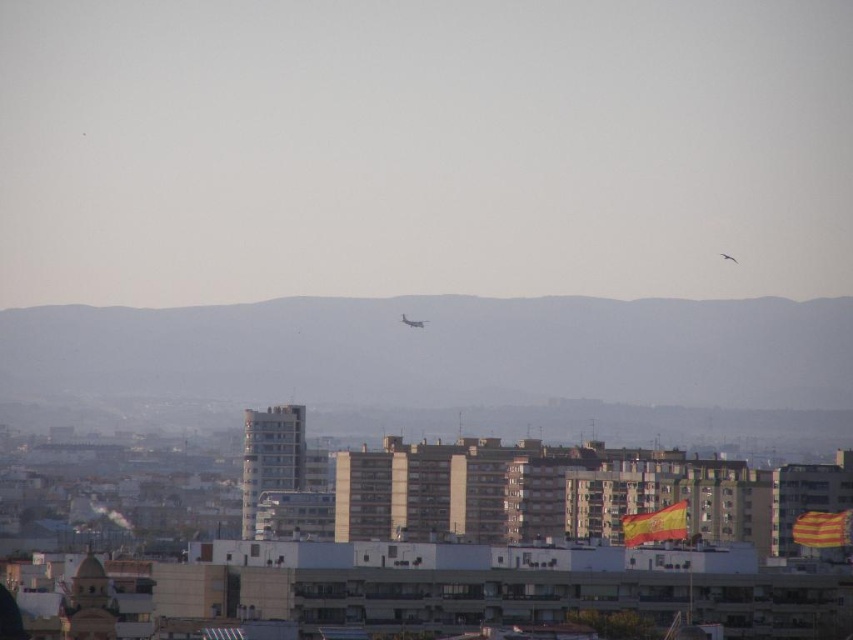
Question: Is metallic silver airplane at center to the right of metallic silver airplane at upper center from the viewer's perspective?

Choices:
 (A) no
 (B) yes

Answer: (A)

Question: From the image, what is the correct spatial relationship of metallic silver airplane at center in relation to metallic silver airplane at upper center?

Choices:
 (A) left
 (B) right

Answer: (A)

Question: Does metallic silver airplane at center appear under metallic silver airplane at upper center?

Choices:
 (A) no
 (B) yes

Answer: (B)

Question: Which point appears farthest from the camera in this image?

Choices:
 (A) (723, 256)
 (B) (421, 323)

Answer: (A)